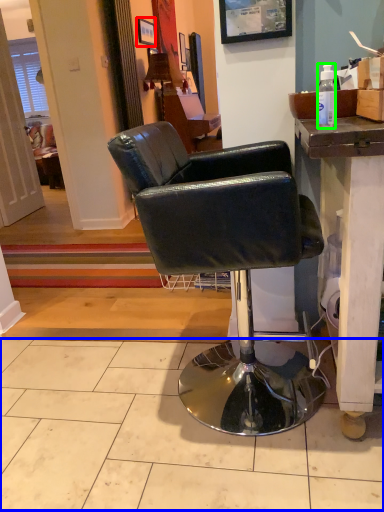
Question: Based on their relative distances, which object is nearer to picture frame (highlighted by a red box)? Choose from tile (highlighted by a blue box) and bottle (highlighted by a green box).

Choices:
 (A) tile
 (B) bottle

Answer: (B)